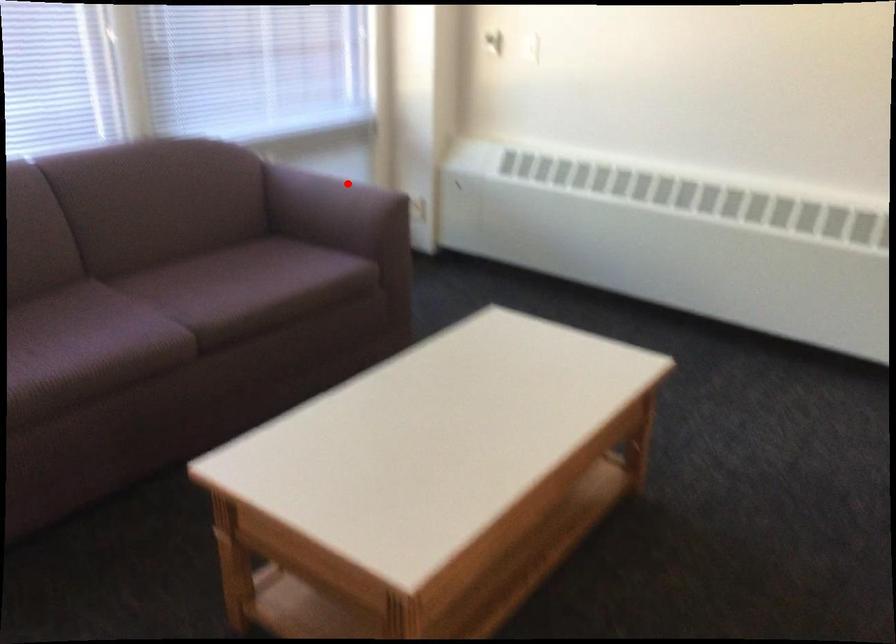
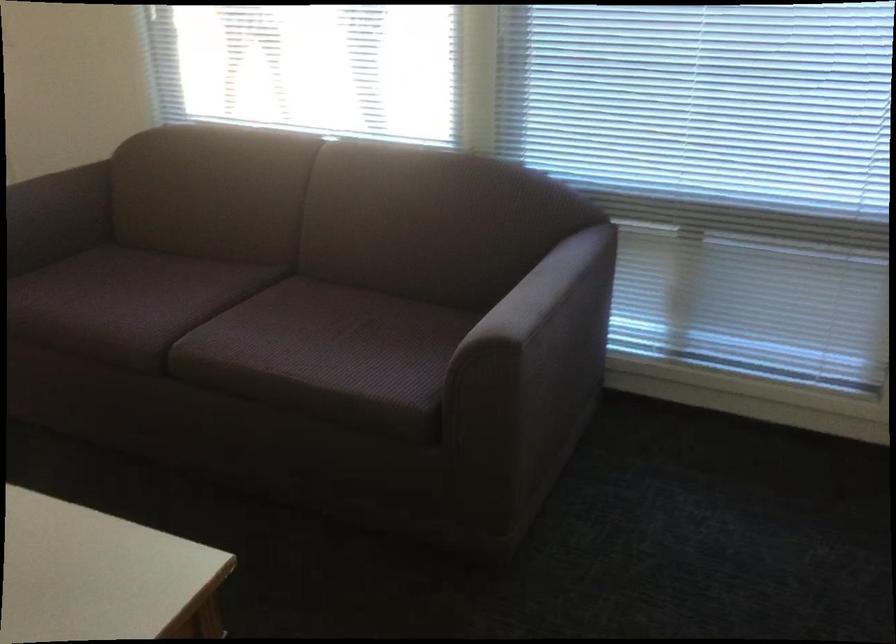
Find the pixel in the second image that matches the highlighted location in the first image.

(545, 294)